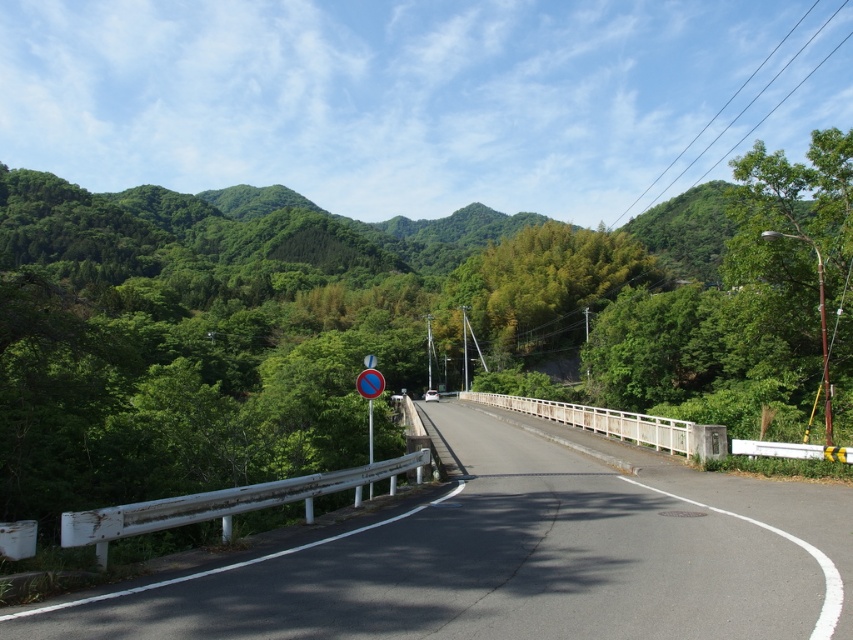
You are standing at the starting point of the road and want to reach the green leafy tree at center. Which direction should you head towards relative to the road?

The green leafy tree at center is located at point coordinates, so you should head towards the center of the road to reach it.

Consider the image. You are standing at the starting point of the road and want to reach the end of the road. Which point, point (x=485, y=620) or point (x=831, y=186), is closer to your current position?

Point (x=485, y=620) is closer to your current position because it is in front of point (x=831, y=186) along the road.

You are a driver approaching the smooth asphalt highway at center and the green leafy tree at right. Which one appears larger in the image?

The green leafy tree at right appears larger than the smooth asphalt highway at center in the image.